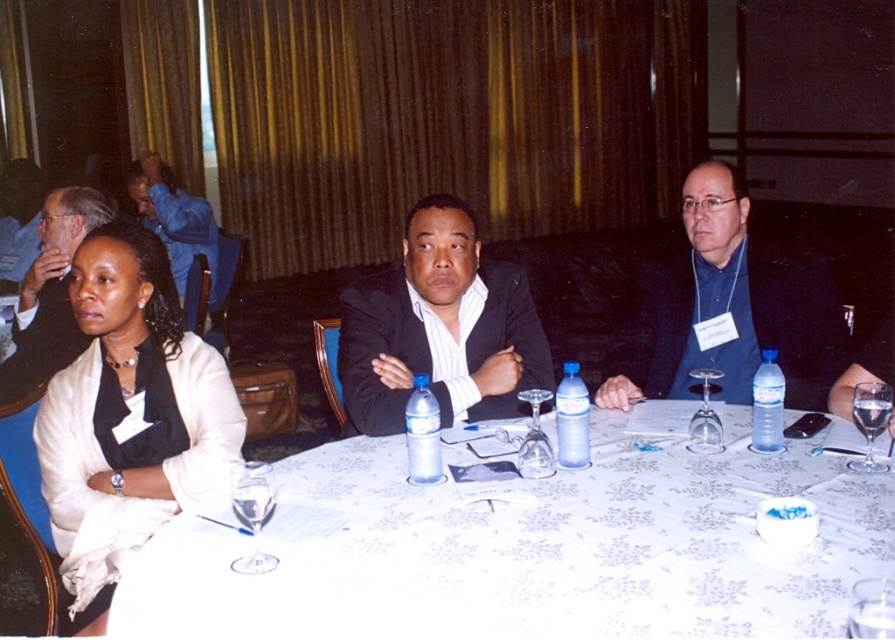
Question: Which of the following is the closest to the observer?

Choices:
 (A) matte black suit at center
 (B) white satin blouse at lower left

Answer: (B)

Question: Which of the following is the farthest from the observer?

Choices:
 (A) clear plastic bottle at center
 (B) blue fabric shirt at right

Answer: (B)

Question: Which point is farther to the camera?

Choices:
 (A) matte black suit at center
 (B) clear plastic bottle at center
 (C) matte black suit at upper left

Answer: (C)

Question: Can you confirm if blue fabric shirt at right is wider than clear plastic bottle at table center?

Choices:
 (A) yes
 (B) no

Answer: (A)

Question: Where is matte black suit at center located in relation to transparent plastic bottle at table center in the image?

Choices:
 (A) right
 (B) left

Answer: (B)

Question: Does blue cotton shirt at upper left have a greater width compared to transparent plastic bottle at table center?

Choices:
 (A) no
 (B) yes

Answer: (B)